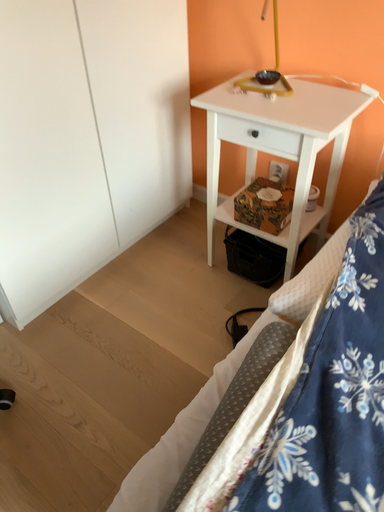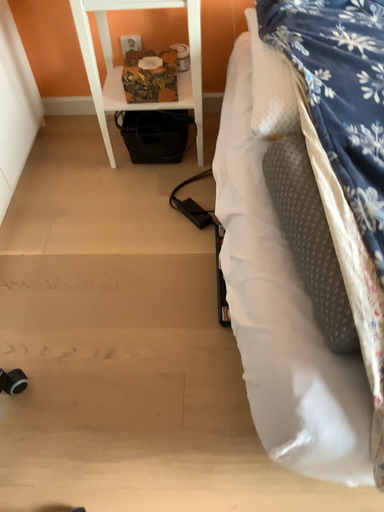
Question: Which way did the camera rotate in the video?

Choices:
 (A) rotated left
 (B) rotated right

Answer: (B)